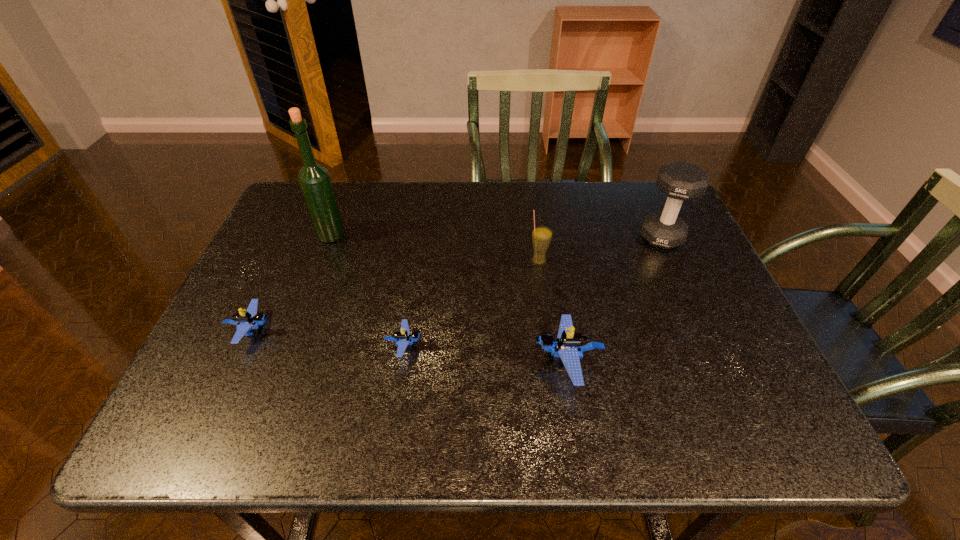
Find the location of `dumbbell situated at the far edge`. dumbbell situated at the far edge is located at coordinates click(x=680, y=181).

Image resolution: width=960 pixels, height=540 pixels. I want to click on liquor located at the far edge, so click(x=314, y=180).

Find the location of a particular element. Lego situated at the left edge is located at coordinates (251, 319).

This screenshot has width=960, height=540. Find the location of `liquor that is at the left edge`. liquor that is at the left edge is located at coordinates (314, 180).

In order to click on object positioned at the right edge in this screenshot , I will do `click(680, 181)`.

I want to click on object at the far left corner, so click(x=314, y=180).

The width and height of the screenshot is (960, 540). I want to click on object present at the far right corner, so click(680, 181).

You are a GUI agent. You are given a task and a screenshot of the screen. Output one action in this format:
    pyautogui.click(x=<x>, y=<y>)
    Task: Click on the free location at the far edge
    Image resolution: width=960 pixels, height=540 pixels.
    Given the screenshot: What is the action you would take?
    pyautogui.click(x=448, y=191)

Find the location of `vacant space at the near edge of the desktop`. vacant space at the near edge of the desktop is located at coordinates (342, 394).

Where is `vacant space at the left edge of the desktop`? The image size is (960, 540). vacant space at the left edge of the desktop is located at coordinates (256, 334).